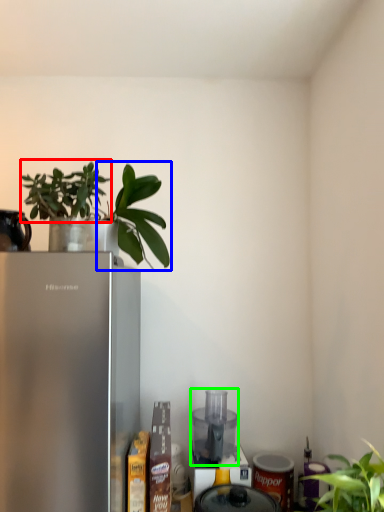
Question: Based on their relative distances, which object is farther from plant (highlighted by a red box)? Choose from plant (highlighted by a blue box) and appliance (highlighted by a green box).

Choices:
 (A) plant
 (B) appliance

Answer: (B)